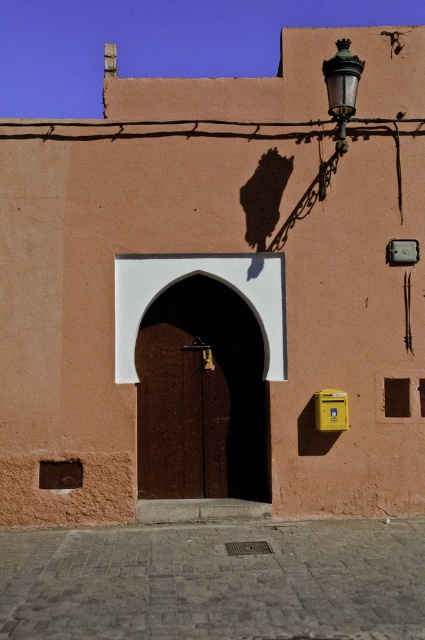
Is brown wooden door at center taller than green glass streetlamp at upper right?

Yes.

Which is in front, point (271, 262) or point (334, 106)?

Point (334, 106) is in front.

Does point (246, 284) come behind point (337, 90)?

Yes, point (246, 284) is farther from viewer.

Image resolution: width=425 pixels, height=640 pixels. I want to click on brown wooden door at center, so click(209, 276).